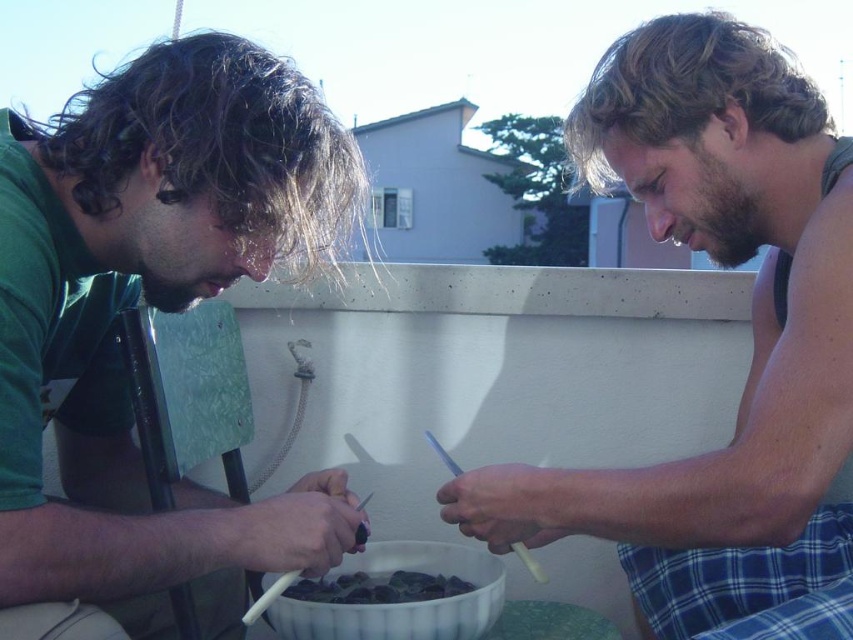
You are a fashion designer observing the scene. You need to determine if the green matte shirt at left can fit into a storage box designed for items narrower than the dark green glossy shells at center. Can it fit?

The green matte shirt at left is wider than the dark green glossy shells at center, so it cannot fit into the storage box designed for items narrower than the dark green glossy shells at center.

You are standing at the point labeled point (688,612) and want to reach the edge of the rooftop. The distance between you and the edge is 1.17 meters. If you take a step forward of 0.5 meters, will you still be safely on the rooftop?

Since the distance between you and the edge is 1.17 meters, taking a 0.5 meters step forward would leave you 0.67 meters away from the edge, so yes, you would still be safely on the rooftop.